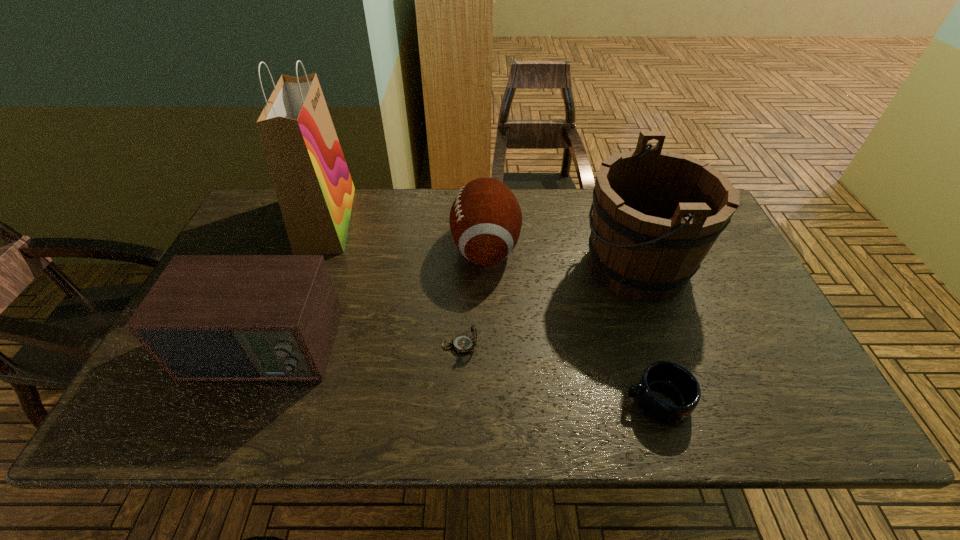
Find the location of a particular element. blank space located on the laces of the football is located at coordinates [x=359, y=247].

Identify the location of free space located on the laces of the football. The width and height of the screenshot is (960, 540). (346, 247).

This screenshot has width=960, height=540. I want to click on free space located on the laces of the football, so click(x=373, y=247).

Locate an element on the screen. The height and width of the screenshot is (540, 960). vacant space located 0.060m on the front-facing side of the radio receiver is located at coordinates [234, 416].

Where is `free space located 0.270m on the face of the compass`? This screenshot has width=960, height=540. free space located 0.270m on the face of the compass is located at coordinates (590, 345).

Locate an element on the screen. Image resolution: width=960 pixels, height=540 pixels. vacant area located 0.110m with the handle on the side of the mug is located at coordinates (573, 401).

What are the coordinates of `free location located with the handle on the side of the mug` in the screenshot? It's located at (527, 401).

Where is `vacant position located with the handle on the side of the mug`? The image size is (960, 540). vacant position located with the handle on the side of the mug is located at coordinates (453, 401).

I want to click on shopping bag that is at the far edge, so click(315, 191).

Identify the location of wine bucket positioned at the far edge. (656, 214).